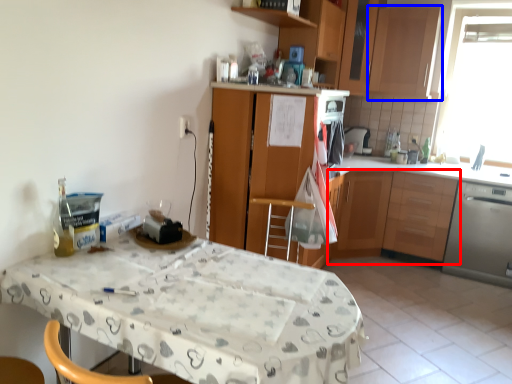
Question: Which object appears closest to the camera in this image, cabinetry (highlighted by a red box) or cabinetry (highlighted by a blue box)?

Choices:
 (A) cabinetry
 (B) cabinetry

Answer: (A)